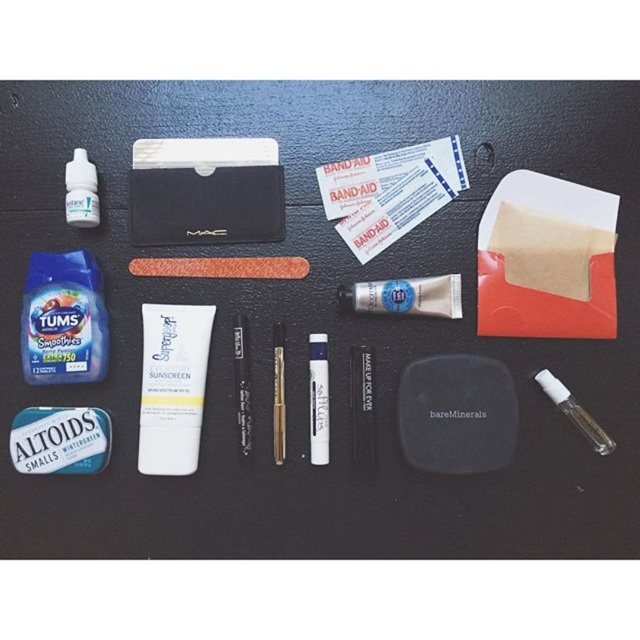
Consider the image. You are packing a small bag for a trip and have to place the white matte tube at center and the clear plastic vial at lower right into your bag. If you want to keep them in the same relative position as in the image, which one should you place first to maintain their left to right order?

The white matte tube at center should be placed first because it is to the left of the clear plastic vial at lower right in the image, so placing it first will maintain their left to right order.

You are packing for a trip and have limited space in your bag. You need to place the blue metallic altoids at lower left and the clear plastic eye drops at upper left into your bag. Based on their positions in the image, which item should you place first to ensure both fit properly?

The blue metallic altoids at lower left should be placed first since it is located below the clear plastic eye drops at upper left in the image, indicating it might be smaller and easier to tuck underneath once the eye drops are positioned.

You are looking at the dark textured surface with the personal care items. There are two points marked on the image at coordinates point (77, 458) and point (74, 179). Which point is closer to you?

Point (77, 458) is further to the camera than point (74, 179), so the point closer to you is point (74, 179).